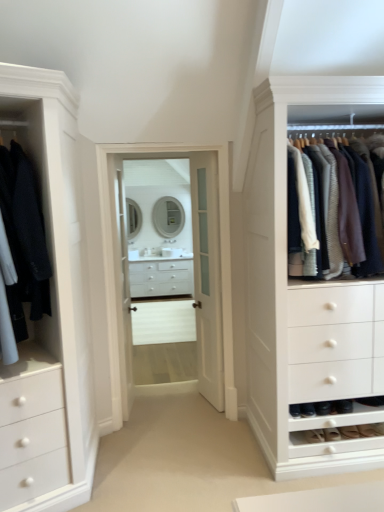
Question: Is clear glass door at center, the 2th glass door in the left-to-right sequence, not inside knit sweater at right, which appears as the 1th clothing when viewed from the right?

Choices:
 (A) no
 (B) yes

Answer: (B)

Question: Is clear glass door at center, which is the 1th glass door in right-to-left order, smaller than knit sweater at right, acting as the second clothing starting from the left?

Choices:
 (A) no
 (B) yes

Answer: (B)

Question: Is clear glass door at center, which is the 1th glass door in right-to-left order, touching knit sweater at right, which appears as the 1th clothing when viewed from the right?

Choices:
 (A) yes
 (B) no

Answer: (B)

Question: Is clear glass door at center, the 2th glass door in the left-to-right sequence, positioned far away from knit sweater at right, which appears as the 1th clothing when viewed from the right?

Choices:
 (A) yes
 (B) no

Answer: (B)

Question: From a real-world perspective, is clear glass door at center, the 2th glass door in the left-to-right sequence, on knit sweater at right, which appears as the 1th clothing when viewed from the right?

Choices:
 (A) no
 (B) yes

Answer: (A)

Question: Based on their sizes in the image, would you say white glass mirror at center, the 1th mirror when ordered from right to left, is bigger or smaller than suede shoe at lower right, positioned as the 2th shoe in right-to-left order?

Choices:
 (A) big
 (B) small

Answer: (A)

Question: Is point pyautogui.click(x=168, y=214) positioned closer to the camera than point pyautogui.click(x=304, y=436)?

Choices:
 (A) closer
 (B) farther

Answer: (B)

Question: Considering the relative positions of white glass mirror at center, the 1th mirror when ordered from right to left, and suede shoe at lower right, the 1th shoe when ordered from left to right, in the image provided, is white glass mirror at center, the 1th mirror when ordered from right to left, to the left or to the right of suede shoe at lower right, the 1th shoe when ordered from left to right,?

Choices:
 (A) right
 (B) left

Answer: (B)

Question: Is white glass mirror at center, the 2th mirror when ordered from left to right, spatially inside suede shoe at lower right, positioned as the 2th shoe in right-to-left order, or outside of it?

Choices:
 (A) inside
 (B) outside

Answer: (B)

Question: From a real-world perspective, is suede brown shoe at lower right, the 2th shoe when ordered from left to right, physically located above or below clear glass door at center, the second glass door viewed from the right?

Choices:
 (A) below
 (B) above

Answer: (A)

Question: From the image's perspective, is suede brown shoe at lower right, arranged as the 1th shoe when viewed from the right, above or below clear glass door at center, the second glass door viewed from the right?

Choices:
 (A) below
 (B) above

Answer: (A)

Question: Is suede brown shoe at lower right, arranged as the 1th shoe when viewed from the right, in front of or behind clear glass door at center, the second glass door viewed from the right, in the image?

Choices:
 (A) front
 (B) behind

Answer: (A)

Question: Is suede brown shoe at lower right, the 2th shoe when ordered from left to right, wider or thinner than clear glass door at center, the first glass door from the left?

Choices:
 (A) wide
 (B) thin

Answer: (A)

Question: Is white glossy drawer at center taller or shorter than white glass door at center?

Choices:
 (A) short
 (B) tall

Answer: (A)

Question: From a real-world perspective, is white glossy drawer at center physically located above or below white glass door at center?

Choices:
 (A) below
 (B) above

Answer: (A)